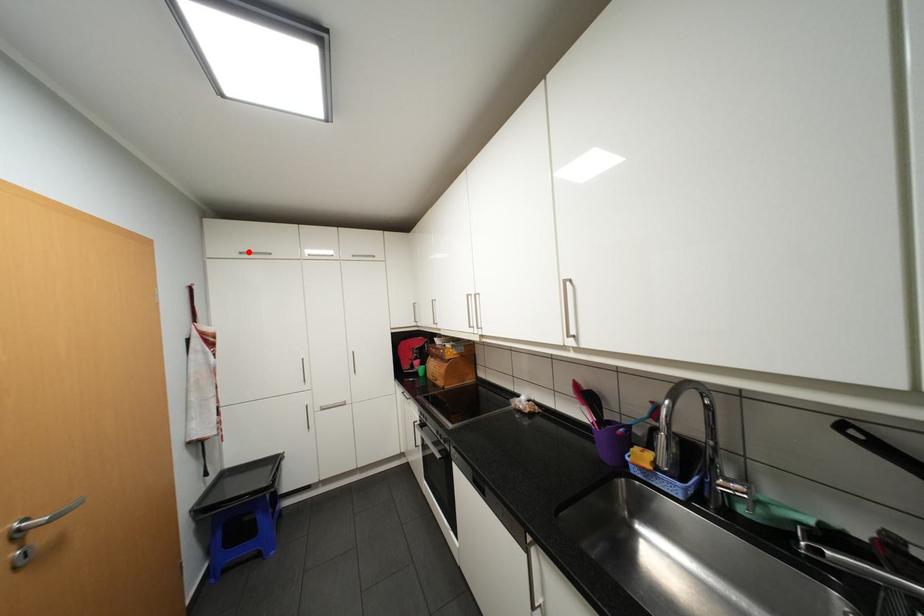
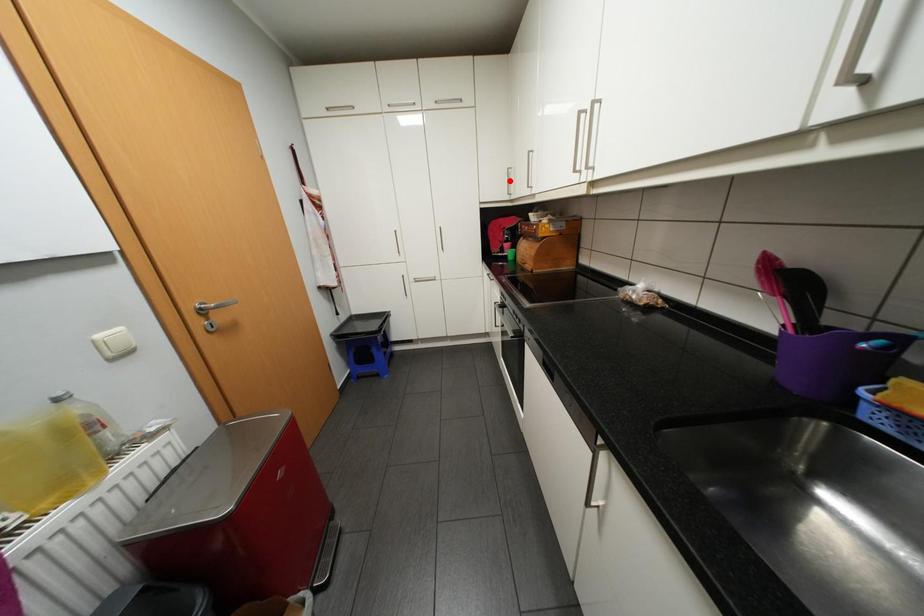
I am providing you with two images of the same scene from different viewpoints. A red point is marked on the first image and another point is marked on the second image. Does the point marked in image1 correspond to the same location as the one in image2?

No